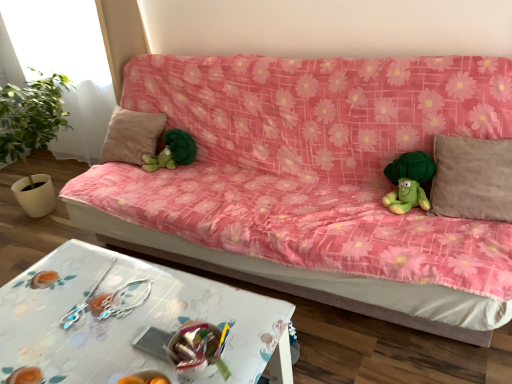
Question: From a real-world perspective, is beige fabric pillow at right, the 2th pillow in the back-to-front sequence, positioned under white glossy table at lower center based on gravity?

Choices:
 (A) no
 (B) yes

Answer: (A)

Question: Is beige fabric pillow at right, which ranks as the first pillow in front-to-back order, to the left of white glossy table at lower center from the viewer's perspective?

Choices:
 (A) yes
 (B) no

Answer: (B)

Question: Can white glossy table at lower center be found inside beige fabric pillow at right, which is counted as the 2th pillow, starting from the left?

Choices:
 (A) yes
 (B) no

Answer: (B)

Question: Is beige fabric pillow at right, which ranks as the first pillow in front-to-back order, shorter than white glossy table at lower center?

Choices:
 (A) no
 (B) yes

Answer: (B)

Question: From the image's perspective, does beige fabric pillow at right, the 2th pillow in the back-to-front sequence, appear lower than white glossy table at lower center?

Choices:
 (A) yes
 (B) no

Answer: (B)

Question: Considering the relative positions of beige fabric pillow at right, which appears as the first pillow when viewed from the right, and white glossy table at lower center in the image provided, is beige fabric pillow at right, which appears as the first pillow when viewed from the right, behind white glossy table at lower center?

Choices:
 (A) no
 (B) yes

Answer: (B)

Question: Considering the relative sizes of transparent glass window at upper left and silver metallic earrings at lower center in the image provided, is transparent glass window at upper left wider than silver metallic earrings at lower center?

Choices:
 (A) yes
 (B) no

Answer: (A)

Question: Is transparent glass window at upper left not within silver metallic earrings at lower center?

Choices:
 (A) no
 (B) yes

Answer: (B)

Question: Considering the relative sizes of transparent glass window at upper left and silver metallic earrings at lower center in the image provided, is transparent glass window at upper left taller than silver metallic earrings at lower center?

Choices:
 (A) yes
 (B) no

Answer: (A)

Question: Does transparent glass window at upper left have a lesser width compared to silver metallic earrings at lower center?

Choices:
 (A) no
 (B) yes

Answer: (A)

Question: Does transparent glass window at upper left come behind silver metallic earrings at lower center?

Choices:
 (A) no
 (B) yes

Answer: (B)

Question: Is transparent glass window at upper left at the right side of silver metallic earrings at lower center?

Choices:
 (A) yes
 (B) no

Answer: (B)

Question: Considering the relative sizes of transparent glass window at upper left and white glossy table at lower center in the image provided, is transparent glass window at upper left shorter than white glossy table at lower center?

Choices:
 (A) no
 (B) yes

Answer: (A)